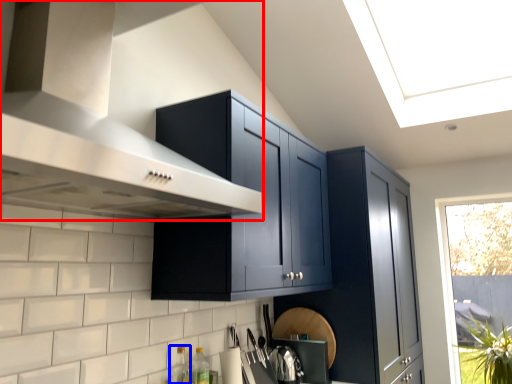
Question: Which of the following is the closest to the observer, vent (highlighted by a red box) or bottle (highlighted by a blue box)?

Choices:
 (A) vent
 (B) bottle

Answer: (A)